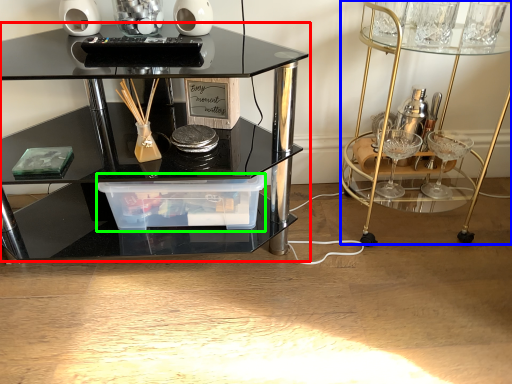
Question: Considering the real-world distances, which object is closest to table (highlighted by a red box)? vanity (highlighted by a blue box) or glass box (highlighted by a green box).

Choices:
 (A) vanity
 (B) glass box

Answer: (B)